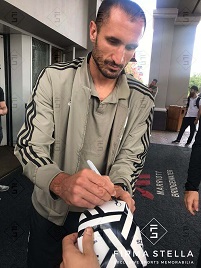
The image size is (201, 268). Find the location of `black marker`. black marker is located at coordinates (94, 167).